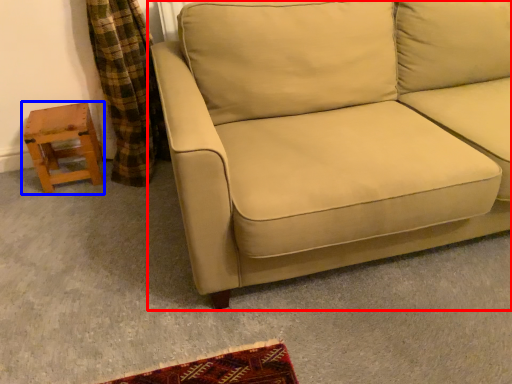
Question: Which of the following is the closest to the observer, studio couch (highlighted by a red box) or stool (highlighted by a blue box)?

Choices:
 (A) studio couch
 (B) stool

Answer: (A)